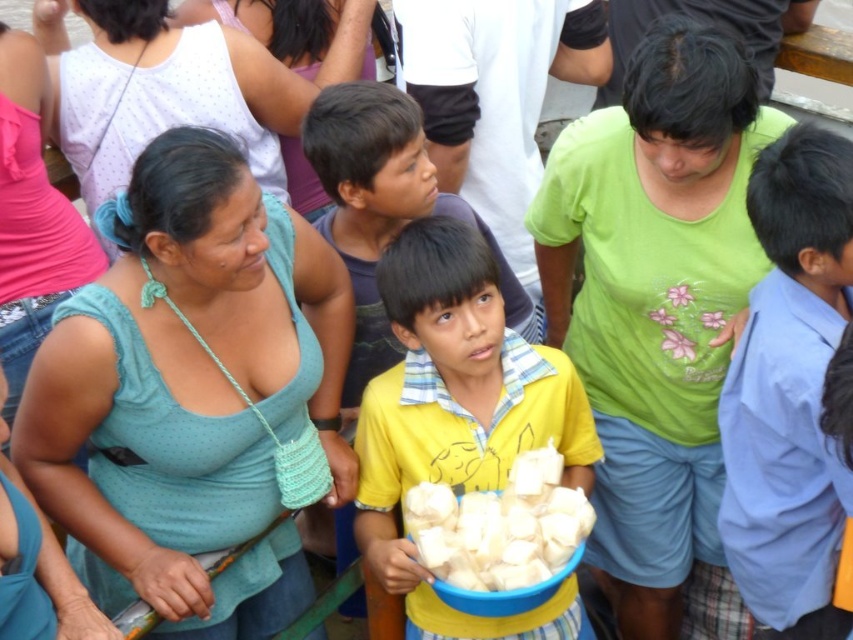
Question: Does matte green tank top at center appear over white soft bread at center?

Choices:
 (A) no
 (B) yes

Answer: (B)

Question: Does matte green tank top at center have a smaller size compared to yellow matte shirt at center?

Choices:
 (A) yes
 (B) no

Answer: (A)

Question: Which object appears farthest from the camera in this image?

Choices:
 (A) yellow cotton shirt at center
 (B) matte green tank top at center
 (C) yellow matte shirt at center
 (D) white soft bread at center

Answer: (B)

Question: Among these points, which one is farthest from the camera?

Choices:
 (A) (584, 524)
 (B) (824, 292)

Answer: (A)

Question: Considering the relative positions of teal fabric shirt at center and matte green tank top at center in the image provided, where is teal fabric shirt at center located with respect to matte green tank top at center?

Choices:
 (A) below
 (B) above

Answer: (A)

Question: Which point appears farthest from the camera in this image?

Choices:
 (A) (189, 77)
 (B) (369, 262)

Answer: (A)